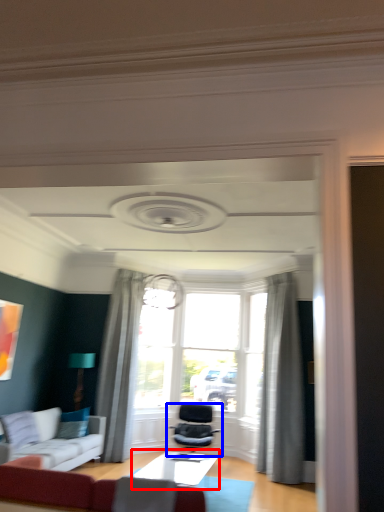
Question: Which point is closer to the camera, table (highlighted by a red box) or chair (highlighted by a blue box)?

Choices:
 (A) table
 (B) chair

Answer: (A)